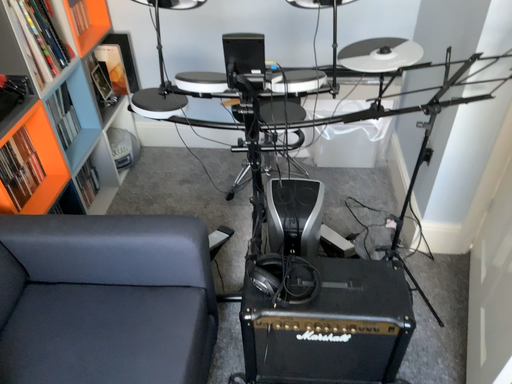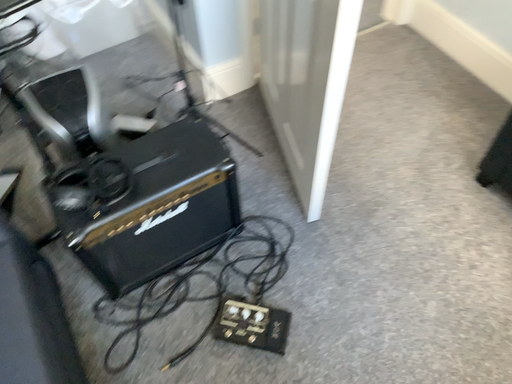
Question: How did the camera likely rotate when shooting the video?

Choices:
 (A) rotated downward
 (B) rotated upward

Answer: (A)